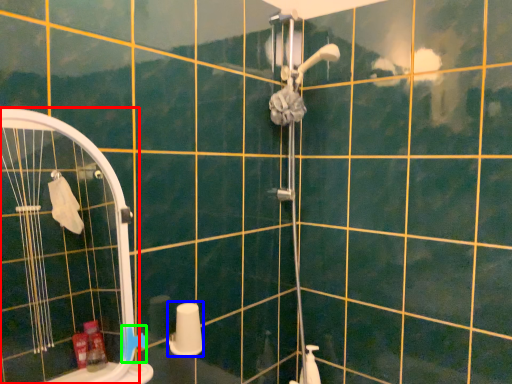
Question: Which object is positioned farthest from screen door (highlighted by a red box)? Select from toilet paper (highlighted by a blue box) and towel bar (highlighted by a green box).

Choices:
 (A) toilet paper
 (B) towel bar

Answer: (B)